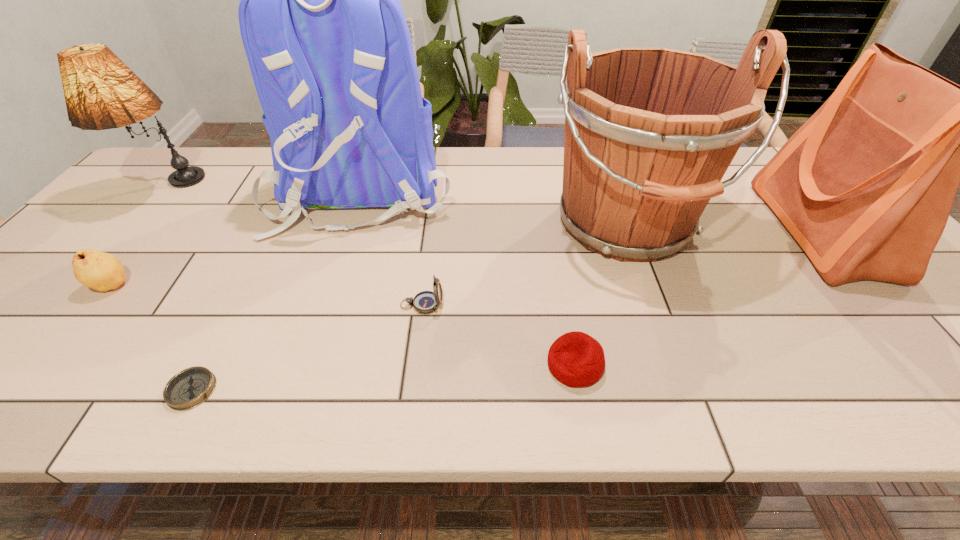
Find the location of `free space that is in between the beanbag and the shopping bag`. free space that is in between the beanbag and the shopping bag is located at coordinates (698, 298).

Identify the location of free space between the second shortest object and the farther compass. (498, 335).

In order to click on unoccupied position between the bucket and the backpack in this screenshot , I will do `click(494, 208)`.

Locate which object is the second closest to the shopping bag. Please provide its 2D coordinates. Your answer should be formatted as a tuple, i.e. [(x, y)], where the tuple contains the x and y coordinates of a point satisfying the conditions above.

[(575, 359)]

Identify which object is located as the sixth nearest to the beanbag. Please provide its 2D coordinates. Your answer should be formatted as a tuple, i.e. [(x, y)], where the tuple contains the x and y coordinates of a point satisfying the conditions above.

[(101, 271)]

This screenshot has height=540, width=960. Find the location of `vacant space that satisfies the following two spatial constraints: 1. on the front pocket of the shopping bag; 2. on the front side of the fifth tallest object`. vacant space that satisfies the following two spatial constraints: 1. on the front pocket of the shopping bag; 2. on the front side of the fifth tallest object is located at coordinates (869, 286).

The height and width of the screenshot is (540, 960). What are the coordinates of `vacant space that satisfies the following two spatial constraints: 1. with the handle on the side of the bucket; 2. on the seat area of the beanbag` in the screenshot? It's located at (677, 364).